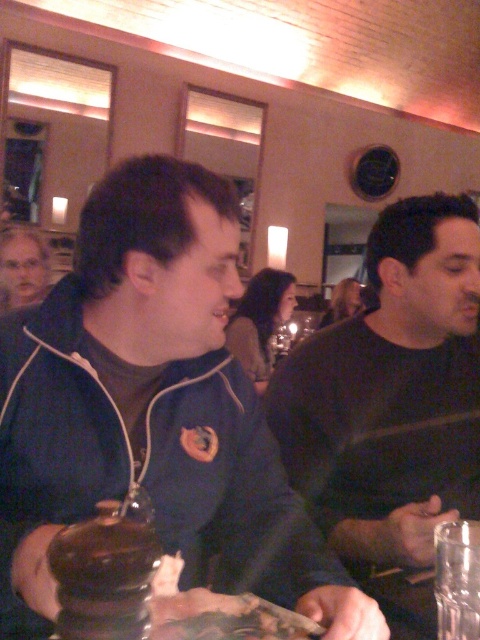
Which is in front, point (463, 564) or point (10, 230)?

Point (463, 564)

Which of these two, transparent glass jar at lower right or gray hair at upper left, stands taller?

With more height is gray hair at upper left.

Locate an element on the screen. This screenshot has width=480, height=640. transparent glass jar at lower right is located at coordinates (456, 579).

Where is `transparent glass jar at lower right`? This screenshot has width=480, height=640. transparent glass jar at lower right is located at coordinates (456, 579).

Looking at this image, is the position of dark gray shirt at center less distant than that of transparent glass jar at lower right?

No, it is behind transparent glass jar at lower right.

Who is more forward, (443, 422) or (456, 563)?

Point (456, 563) is more forward.

Between point (456, 208) and point (456, 600), which one is positioned in front?

Positioned in front is point (456, 600).

I want to click on dark gray shirt at center, so click(x=392, y=392).

Can you confirm if blue fleece jacket at center is shorter than dark gray shirt at center?

Incorrect, blue fleece jacket at center's height does not fall short of dark gray shirt at center's.

Is point (112, 385) positioned behind point (432, 557)?

No, (112, 385) is in front of (432, 557).

Between point (214, 218) and point (394, 285), which one is positioned behind?

The point (394, 285) is more distant.

Where is `blue fleece jacket at center`? This screenshot has width=480, height=640. blue fleece jacket at center is located at coordinates (152, 406).